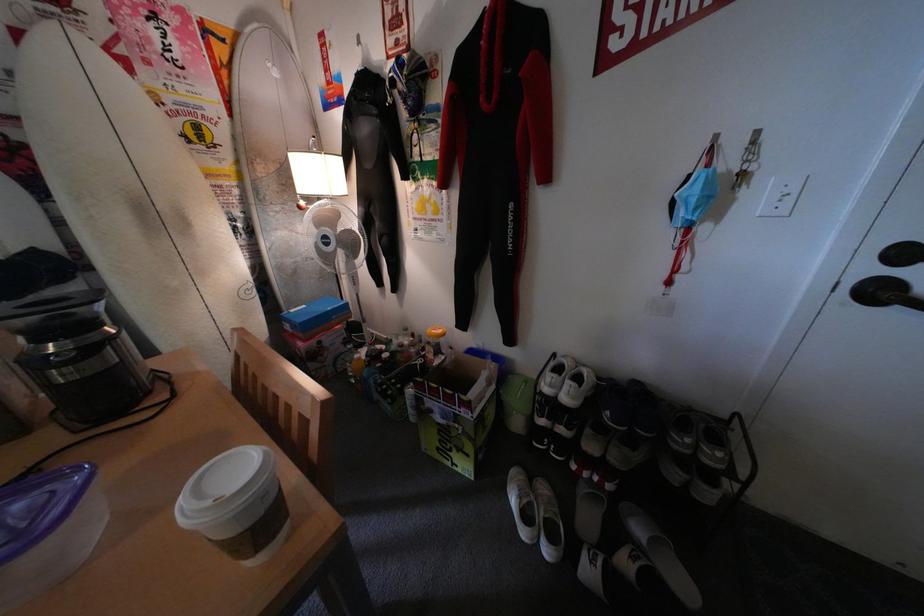
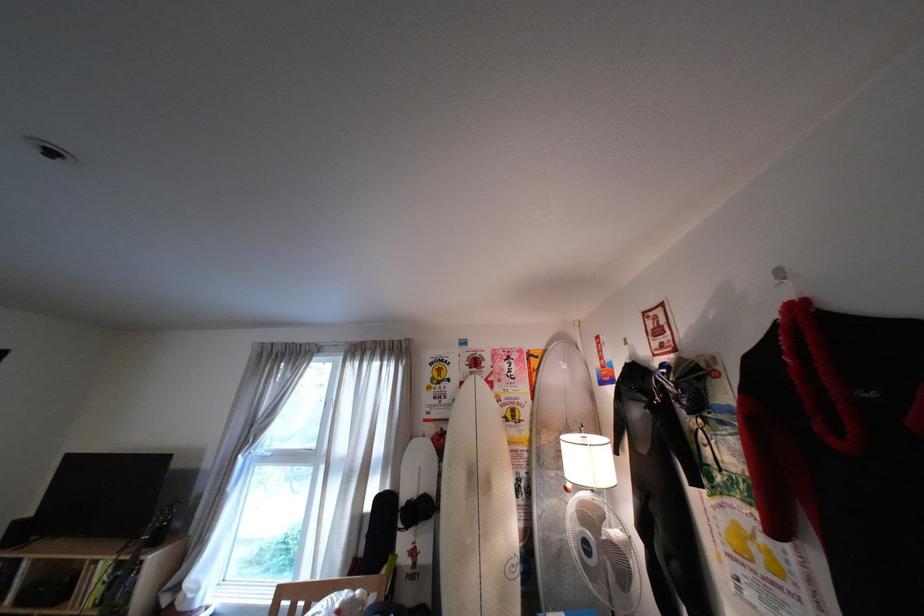
First-person continuous shooting, in which direction is the camera rotating?

The rotation direction of the camera is left-up.